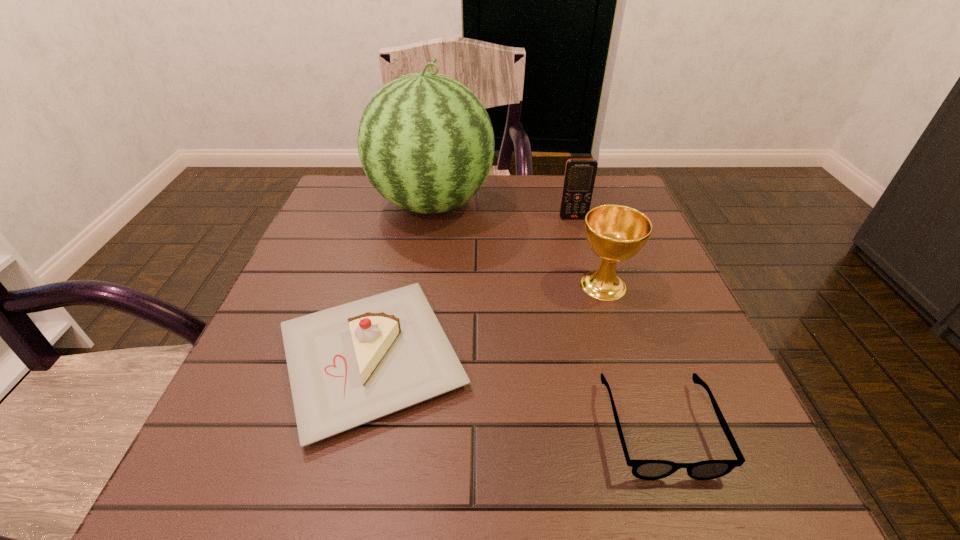
You are a GUI agent. You are given a task and a screenshot of the screen. Output one action in this format:
    pyautogui.click(x=<x>, y=<y>)
    Task: Click on the free space between the spectacles and the chalice
    The height and width of the screenshot is (540, 960).
    Given the screenshot: What is the action you would take?
    pyautogui.click(x=631, y=356)

This screenshot has height=540, width=960. Find the location of `vacant region between the cellular telephone and the cake`. vacant region between the cellular telephone and the cake is located at coordinates (472, 288).

The image size is (960, 540). In order to click on free spot between the chalice and the cellular telephone in this screenshot , I will do `click(588, 252)`.

Find the location of a particular element. empty space that is in between the watermelon and the cake is located at coordinates (401, 281).

What are the coordinates of `free space between the cellular telephone and the chalice` in the screenshot? It's located at (588, 252).

This screenshot has width=960, height=540. What are the coordinates of `free space between the cellular telephone and the chalice` in the screenshot? It's located at (588, 252).

Locate an element on the screen. free space between the cellular telephone and the tallest object is located at coordinates (503, 211).

The height and width of the screenshot is (540, 960). I want to click on free space between the chalice and the watermelon, so click(x=517, y=245).

Find the location of a particular element. object that is the closest to the tallest object is located at coordinates (580, 174).

Select which object appears as the third closest to the spectacles. Please provide its 2D coordinates. Your answer should be formatted as a tuple, i.e. [(x, y)], where the tuple contains the x and y coordinates of a point satisfying the conditions above.

[(426, 143)]